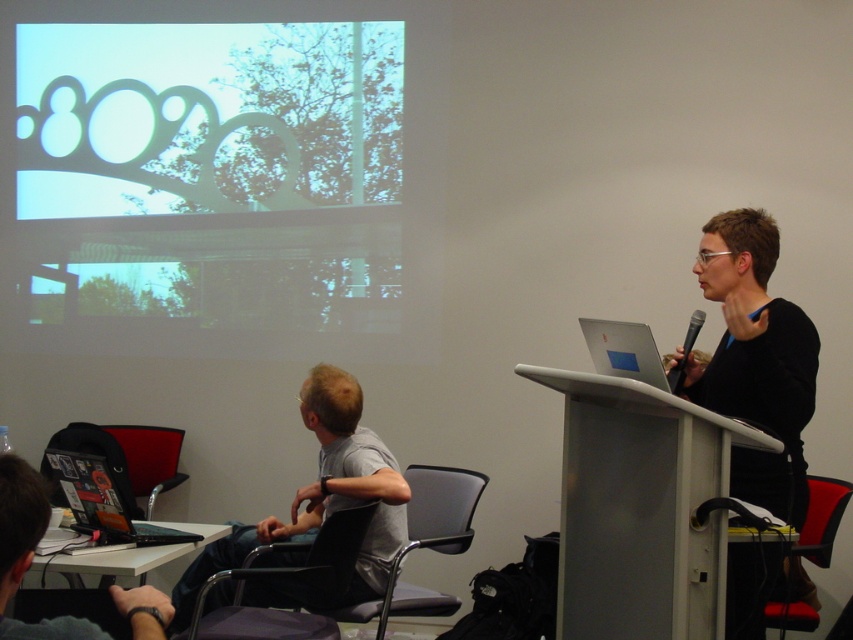
Question: Considering the real-world distances, which object is closest to the gray fabric shirt at lower left?

Choices:
 (A) red fabric chair at lower right
 (B) black matte laptop at lower left
 (C) black mesh chair at lower center

Answer: (C)

Question: Does black mesh chair at lower center come behind black fabric chair at lower left?

Choices:
 (A) yes
 (B) no

Answer: (B)

Question: Considering the relative positions of black matte laptop at lower left and black mesh chair at lower center in the image provided, where is black matte laptop at lower left located with respect to black mesh chair at lower center?

Choices:
 (A) right
 (B) left

Answer: (B)

Question: Which point is farther to the camera?

Choices:
 (A) black matte laptop at lower left
 (B) black plastic laptop at lower left

Answer: (B)

Question: Can you confirm if white matte projection screen at upper left is bigger than black fabric chair at lower center?

Choices:
 (A) no
 (B) yes

Answer: (B)

Question: Which object is positioned farthest from the black fabric chair at lower left?

Choices:
 (A) black fabric chair at lower center
 (B) black matte laptop at lower left

Answer: (B)